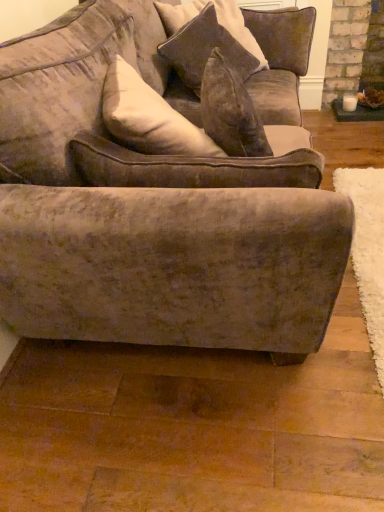
Question: Does point (236, 39) appear closer or farther from the camera than point (41, 55)?

Choices:
 (A) closer
 (B) farther

Answer: (B)

Question: From the image's perspective, is velvet cushion at upper center above or below velvet brown couch at center?

Choices:
 (A) below
 (B) above

Answer: (B)

Question: Which object is positioned farthest from the velvet brown couch at center?

Choices:
 (A) velvet cushion at upper center
 (B) velvet brown couch at center

Answer: (A)

Question: Which object is positioned closest to the velvet brown couch at center?

Choices:
 (A) velvet brown couch at center
 (B) velvet cushion at upper center

Answer: (A)